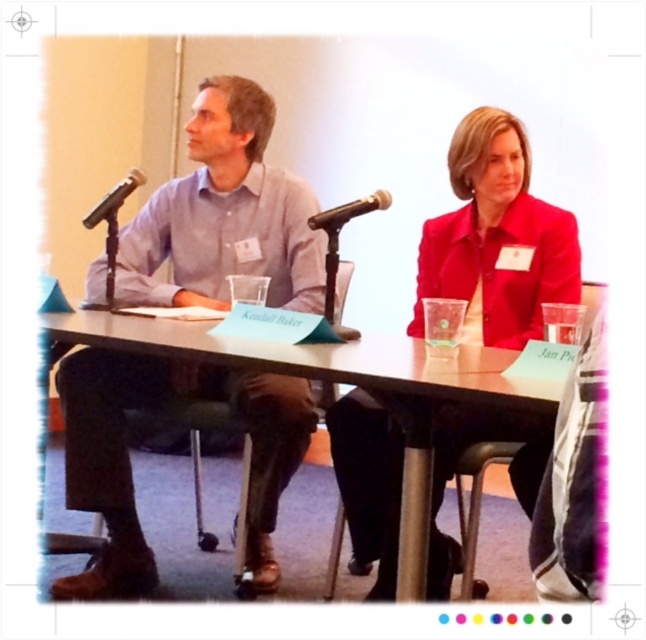
Locate an element on the screen. The height and width of the screenshot is (640, 646). matte light blue shirt at center is located at coordinates (224, 212).

Is point (112, 536) less distant than point (463, 380)?

No, (112, 536) is behind (463, 380).

Is point (253, 580) closer to camera compared to point (339, 360)?

No, (253, 580) is further to viewer.

Find the location of a particular element. matte light blue shirt at center is located at coordinates (224, 212).

Between matte red blazer at center and black matte microphone at left, which one has less height?

With less height is black matte microphone at left.

Does matte red blazer at center have a lesser width compared to black matte microphone at left?

No, matte red blazer at center is not thinner than black matte microphone at left.

Which is behind, point (432, 228) or point (127, 177)?

Point (432, 228)

Where is `matte red blazer at center`? This screenshot has width=646, height=640. matte red blazer at center is located at coordinates pos(495,237).

Which is in front, point (220, 168) or point (432, 577)?

Point (432, 577) is more forward.

Does matte light blue shirt at center have a greater width compared to matte red blazer at center?

Correct, the width of matte light blue shirt at center exceeds that of matte red blazer at center.

Is point (271, 580) in front of point (539, 202)?

No, it is behind (539, 202).

Where is `matte light blue shirt at center`? This screenshot has width=646, height=640. matte light blue shirt at center is located at coordinates (224, 212).